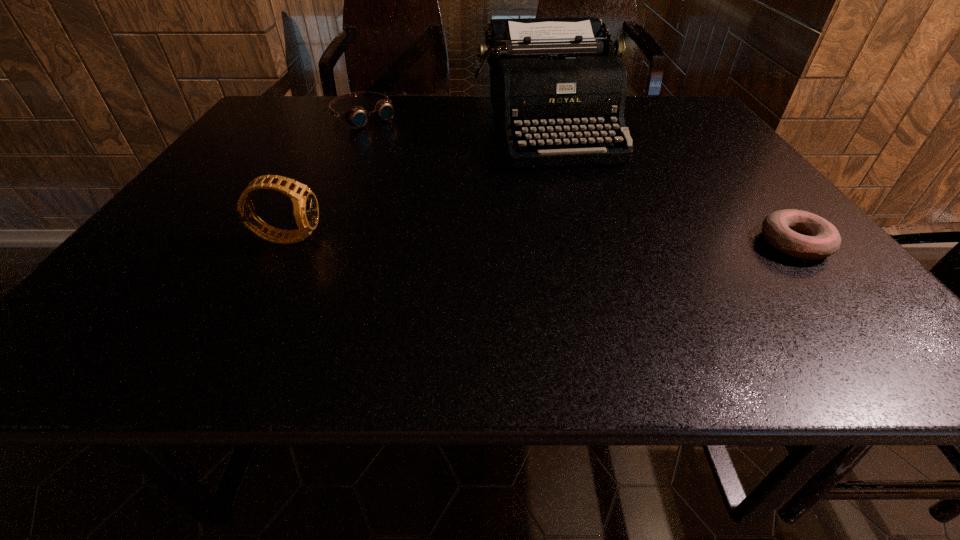
Identify the location of watch. This screenshot has width=960, height=540. (306, 211).

Locate an element on the screen. The width and height of the screenshot is (960, 540). the rightmost object is located at coordinates (800, 234).

You are a GUI agent. You are given a task and a screenshot of the screen. Output one action in this format:
    pyautogui.click(x=<x>, y=<y>)
    Task: Click on the doughnut
    The height and width of the screenshot is (540, 960).
    Given the screenshot: What is the action you would take?
    pyautogui.click(x=800, y=234)

Identify the location of typewriter. The width and height of the screenshot is (960, 540). (558, 81).

Locate an element on the screen. the second object from right to left is located at coordinates (558, 81).

Where is `goggles`? This screenshot has height=540, width=960. goggles is located at coordinates (356, 116).

Identify the location of free space located on the face of the third shortest object. (487, 237).

Locate an element on the screen. This screenshot has width=960, height=540. vacant area located 0.190m on the back of the doughnut is located at coordinates (738, 176).

You are a GUI agent. You are given a task and a screenshot of the screen. Output one action in this format:
    pyautogui.click(x=<x>, y=<y>)
    Task: Click on the blank space located on the typing side of the typewriter
    Image resolution: width=960 pixels, height=540 pixels.
    Given the screenshot: What is the action you would take?
    pyautogui.click(x=612, y=276)

Find the location of a particular element. The image size is (960, 540). blank space located 0.240m on the typing side of the typewriter is located at coordinates pyautogui.click(x=592, y=232).